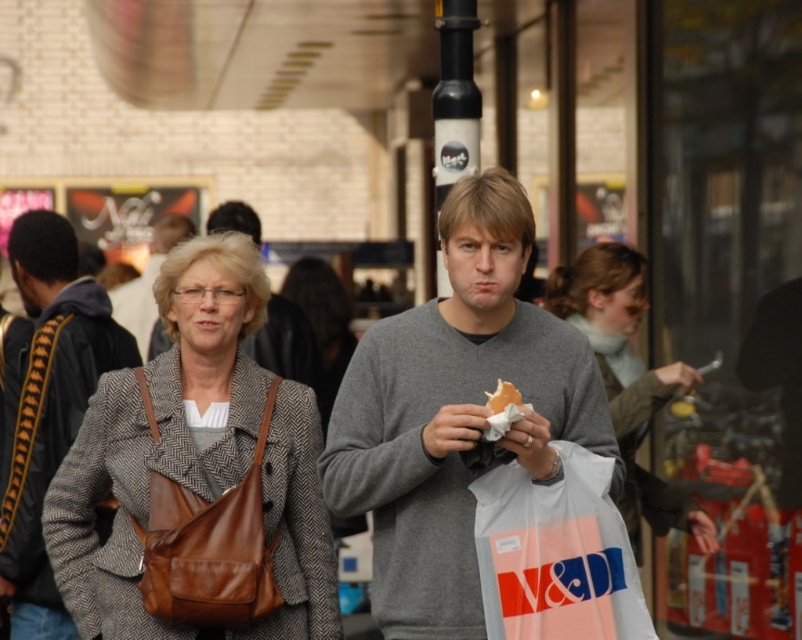
Question: Does gray matte sweater at center lie behind brown leather bag at center-left?

Choices:
 (A) no
 (B) yes

Answer: (A)

Question: Which object is positioned farthest from the gray fabric sweater at center?

Choices:
 (A) white paper sandwich at center
 (B) matte brown leather bag at center
 (C) gray matte sweater at center

Answer: (B)

Question: In this image, where is matte brown leather bag at center located relative to gray matte sweater at center?

Choices:
 (A) above
 (B) below

Answer: (B)

Question: Can you confirm if brown leather bag at center-left is smaller than gray sweater at center?

Choices:
 (A) yes
 (B) no

Answer: (B)

Question: Which is farther from the gray wool coat at center?

Choices:
 (A) brown leather bag at center-left
 (B) gray fabric sweater at center
 (C) matte gray coat at center
 (D) white paper sandwich at center

Answer: (D)

Question: Which point is farther to the camera?

Choices:
 (A) white paper sandwich at center
 (B) matte gray coat at center
 (C) gray fabric sweater at center

Answer: (B)